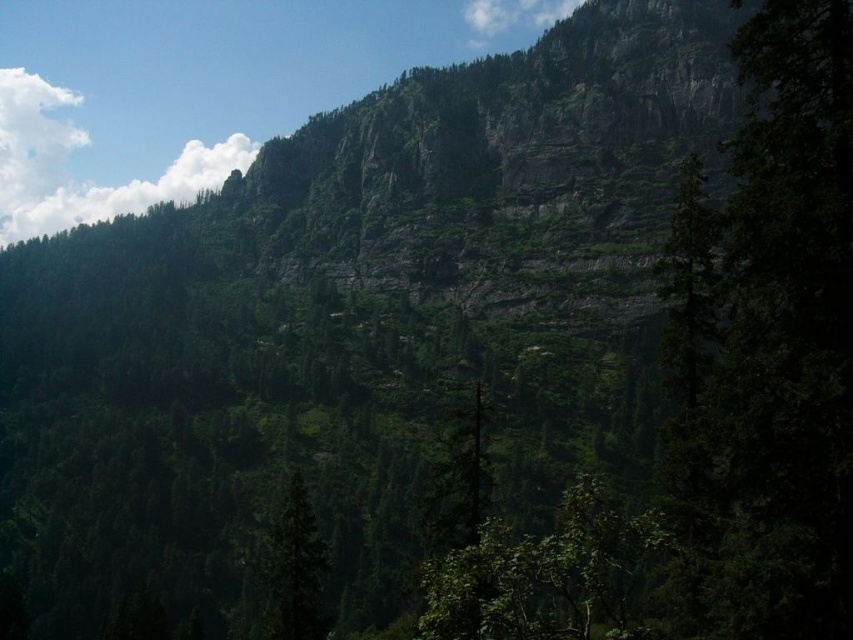
Question: Which is farther from the white fluffy cloud at upper center?

Choices:
 (A) green leafy tree at center
 (B) white fluffy cloud at upper left

Answer: (B)

Question: Which object is farther from the camera taking this photo?

Choices:
 (A) green matte tree at center
 (B) white fluffy cloud at upper center
 (C) green leafy tree at center
 (D) white fluffy cloud at upper left

Answer: (D)

Question: Is white fluffy cloud at upper left smaller than green matte tree at center?

Choices:
 (A) no
 (B) yes

Answer: (A)

Question: Where is green matte tree at center located in relation to white fluffy cloud at upper center in the image?

Choices:
 (A) right
 (B) left

Answer: (B)

Question: Considering the real-world distances, which object is closest to the green leafy tree at center?

Choices:
 (A) white fluffy cloud at upper center
 (B) green matte tree at center

Answer: (B)

Question: Is white fluffy cloud at upper left closer to the viewer compared to white fluffy cloud at upper center?

Choices:
 (A) no
 (B) yes

Answer: (A)